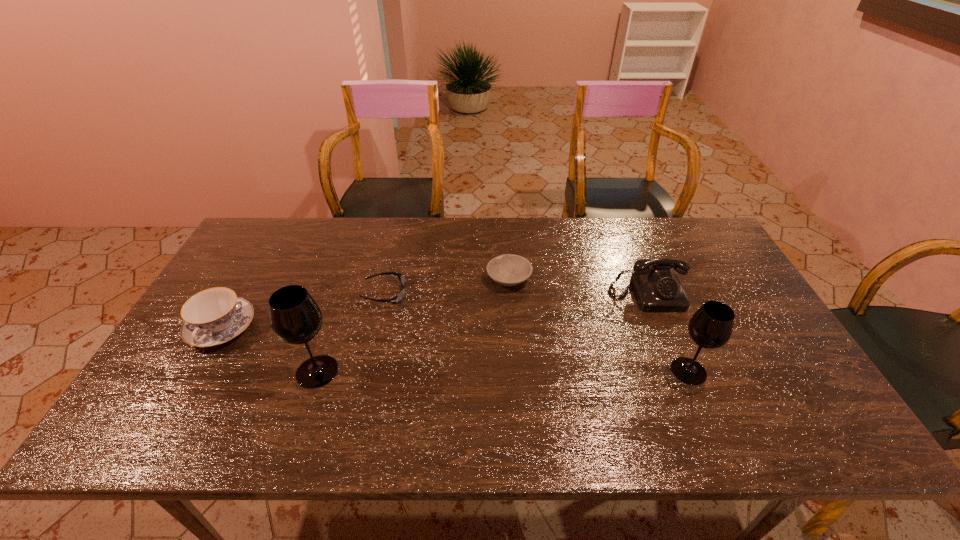
I want to click on sunglasses, so click(x=396, y=299).

At what (x,y) coordinates should I click in order to perform the action: click on free space located 0.340m on the back of the taller wineglass. Please return your answer as a coordinate pair (x, y). The width and height of the screenshot is (960, 540). Looking at the image, I should click on (351, 268).

The width and height of the screenshot is (960, 540). What are the coordinates of `vacant space located on the back of the shorter wineglass` in the screenshot? It's located at (674, 335).

You are a GUI agent. You are given a task and a screenshot of the screen. Output one action in this format:
    pyautogui.click(x=<x>, y=<y>)
    Task: Click on the vacant space situated on the front of the third object from right to left
    
    Given the screenshot: What is the action you would take?
    click(x=512, y=314)

At what (x,y) coordinates should I click in order to perform the action: click on vacant point located with the handle on the side of the chinaware. Please return your answer as a coordinate pair (x, y). The height and width of the screenshot is (540, 960). Looking at the image, I should click on (186, 389).

Where is `vacant space located 0.260m on the dial of the fourth shortest object`? vacant space located 0.260m on the dial of the fourth shortest object is located at coordinates (686, 392).

Find the location of `vacant area located on the lenses of the sunglasses`. vacant area located on the lenses of the sunglasses is located at coordinates coord(544,294).

Identify the location of object present at the left edge. (214, 316).

Identify the location of free space at the far edge of the desktop. This screenshot has height=540, width=960. (436, 225).

I want to click on free region at the near edge of the desktop, so click(456, 401).